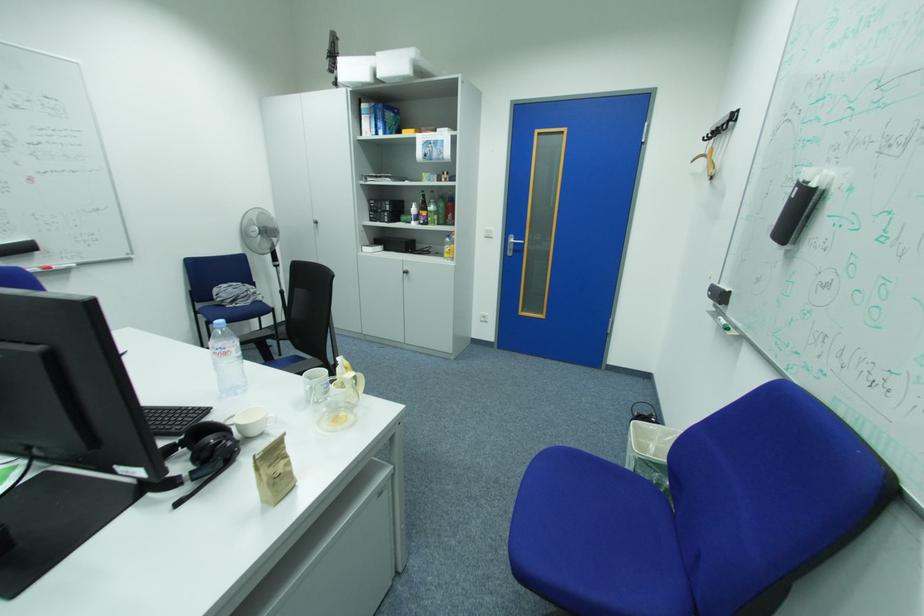
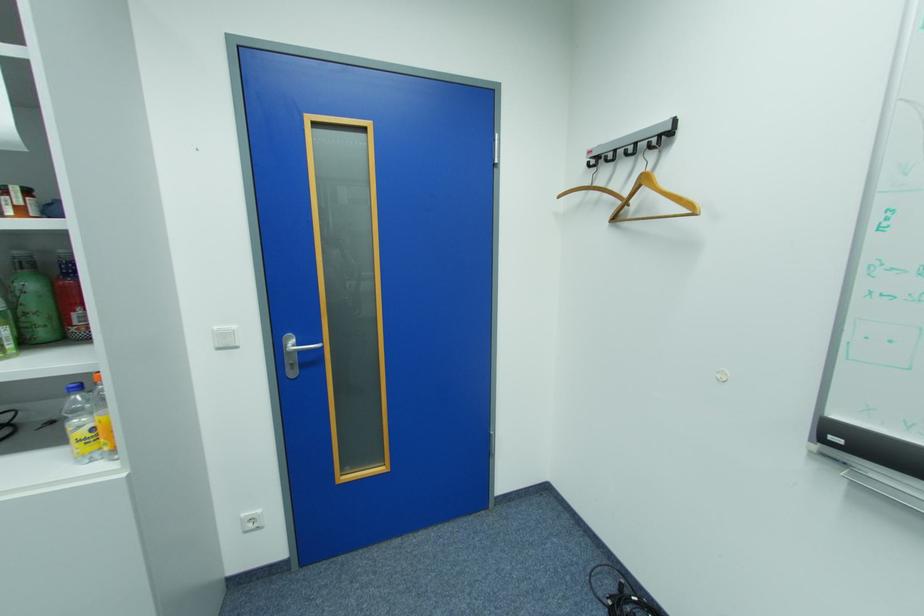
Where in the second image is the point corresponding to pixel 450 206 from the first image?

(41, 286)